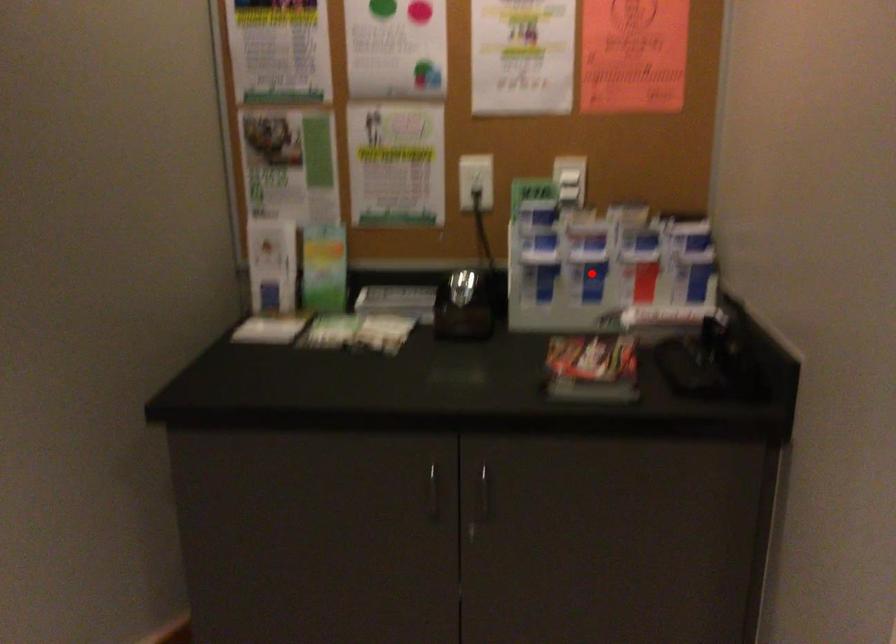
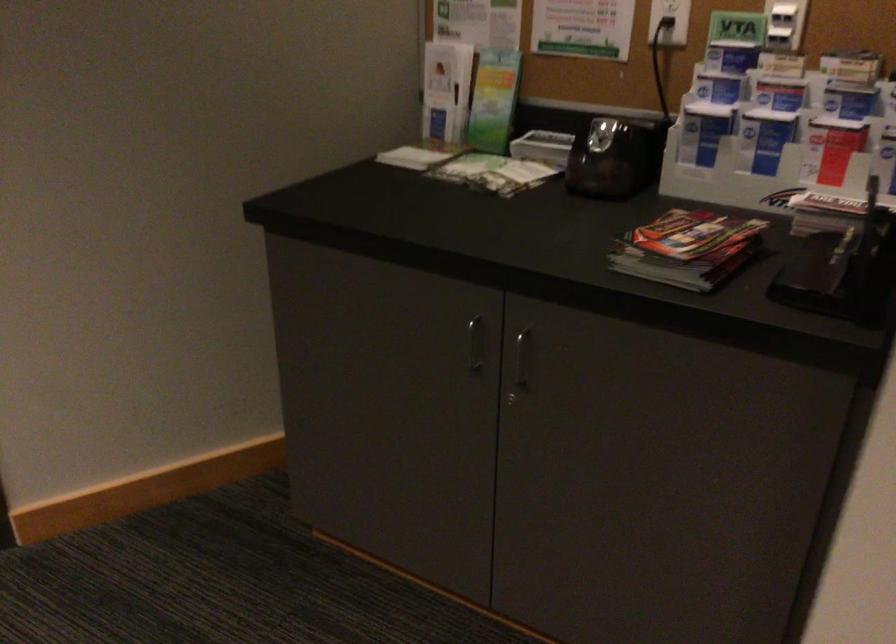
In the second image, find the point that corresponds to the highlighted location in the first image.

(764, 138)